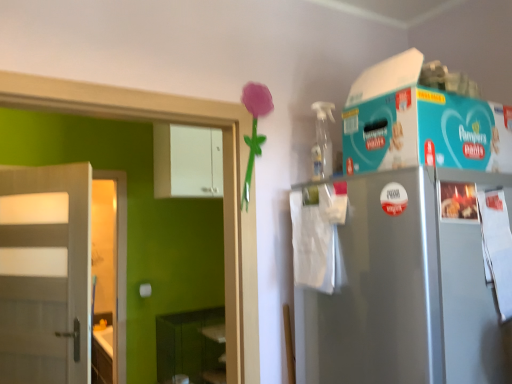
Question: From the image's perspective, is white glossy cabinet at upper center positioned above or below green matte shelf at lower left?

Choices:
 (A) above
 (B) below

Answer: (A)

Question: From their relative heights in the image, would you say white glossy cabinet at upper center is taller or shorter than green matte shelf at lower left?

Choices:
 (A) short
 (B) tall

Answer: (A)

Question: Which is nearer to the white matte door at left?

Choices:
 (A) white glossy cabinet at upper center
 (B) green matte shelf at lower left

Answer: (A)

Question: Which object is positioned closest to the white glossy cabinet at upper center?

Choices:
 (A) green matte shelf at lower left
 (B) white matte door at left

Answer: (B)